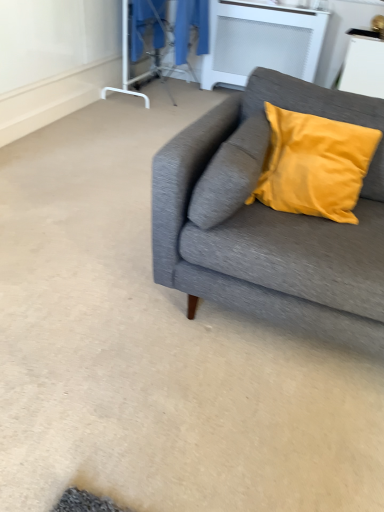
Locate an element on the screen. vacant space in front of blue fabric laundry at upper center is located at coordinates click(x=136, y=108).